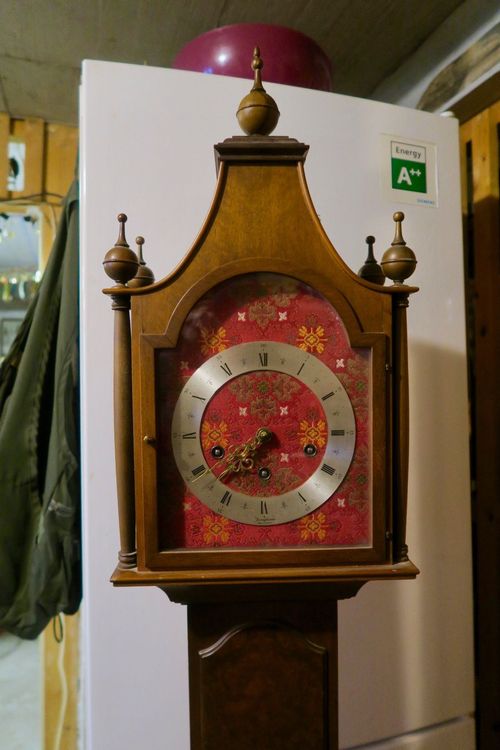
I want to click on top of clock, so click(x=256, y=46).